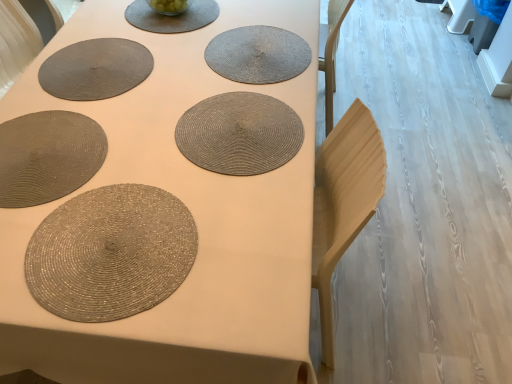
This screenshot has height=384, width=512. Identify the location of free area behind rattan placemat at center, arranged as the 2th coaster when ordered from the bottom. (248, 13).